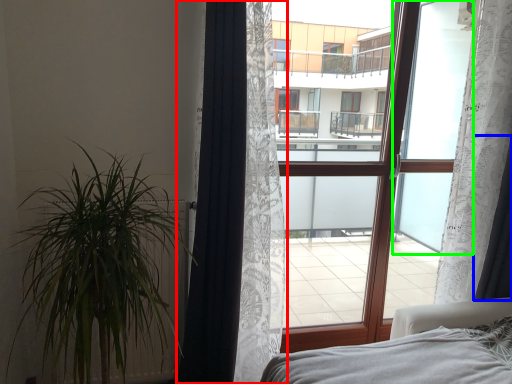
Question: Based on their relative distances, which object is nearer to curtain (highlighted by a red box)? Choose from curtain (highlighted by a blue box) and window screen (highlighted by a green box).

Choices:
 (A) curtain
 (B) window screen

Answer: (B)